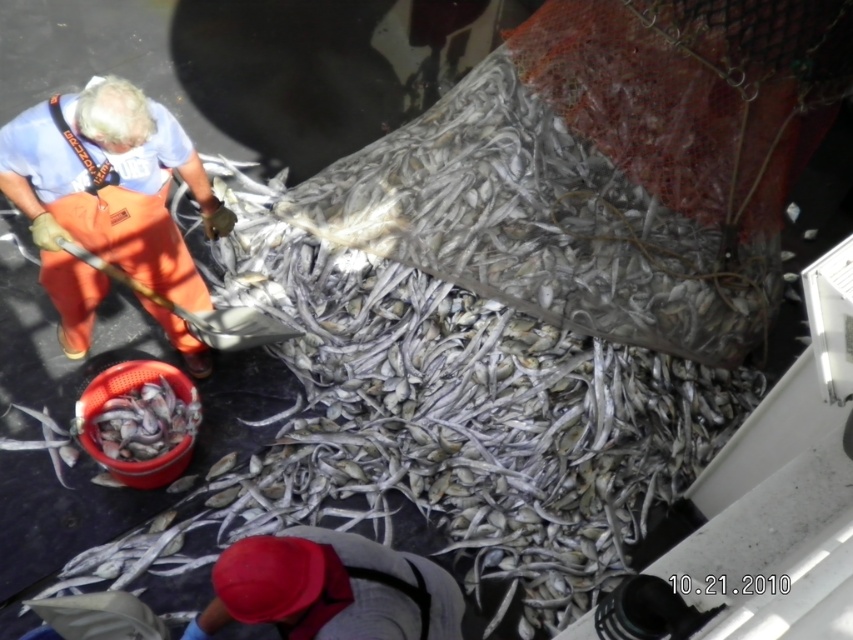
Measure the distance between gray fabric cap at lower center and camera.

The distance of gray fabric cap at lower center from camera is 6.50 feet.

Is gray fabric cap at lower center to the left of silvery metallic fish at lower left from the viewer's perspective?

No, gray fabric cap at lower center is not to the left of silvery metallic fish at lower left.

Which is behind, point (239, 616) or point (62, 433)?

Point (62, 433)

Find the location of a particular element. gray fabric cap at lower center is located at coordinates (329, 588).

Does orange fabric worker at left come in front of gray fabric cap at lower center?

No, orange fabric worker at left is behind gray fabric cap at lower center.

Is orange fabric worker at left smaller than gray fabric cap at lower center?

Actually, orange fabric worker at left might be larger than gray fabric cap at lower center.

Is point (204, 296) closer to viewer compared to point (438, 618)?

No.

This screenshot has width=853, height=640. What are the coordinates of `orange fabric worker at left` in the screenshot? It's located at (105, 196).

Does silvery metallic fish at lower center have a lesser height compared to silvery metallic fish at lower left?

In fact, silvery metallic fish at lower center may be taller than silvery metallic fish at lower left.

Does point (123, 419) lie in front of point (45, 436)?

Yes, it is.

You are a GUI agent. You are given a task and a screenshot of the screen. Output one action in this format:
    pyautogui.click(x=<x>, y=<y>)
    Task: Click on the silvery metallic fish at lower center
    The width and height of the screenshot is (853, 640).
    Given the screenshot: What is the action you would take?
    pyautogui.click(x=144, y=420)